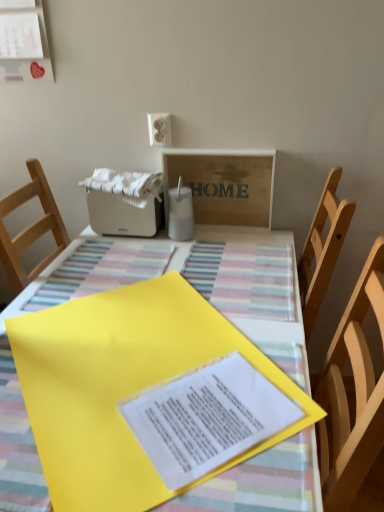
Question: Is yellow paper at center at the left side of yellow paper at center?

Choices:
 (A) no
 (B) yes

Answer: (A)

Question: From the image's perspective, is yellow paper at center on top of yellow paper at center?

Choices:
 (A) no
 (B) yes

Answer: (B)

Question: Is yellow paper at center looking in the opposite direction of yellow paper at center?

Choices:
 (A) yes
 (B) no

Answer: (B)

Question: From the image's perspective, is yellow paper at center beneath yellow paper at center?

Choices:
 (A) no
 (B) yes

Answer: (A)

Question: Is yellow paper at center behind yellow paper at center?

Choices:
 (A) yes
 (B) no

Answer: (A)

Question: Considering the positions of white plastic toaster at upper center and wooden signboard at upper center in the image, is white plastic toaster at upper center wider or thinner than wooden signboard at upper center?

Choices:
 (A) wide
 (B) thin

Answer: (A)

Question: From the image's perspective, is white plastic toaster at upper center above or below wooden signboard at upper center?

Choices:
 (A) below
 (B) above

Answer: (A)

Question: Is white plastic toaster at upper center to the left or to the right of wooden signboard at upper center in the image?

Choices:
 (A) right
 (B) left

Answer: (B)

Question: In terms of size, does white plastic toaster at upper center appear bigger or smaller than wooden signboard at upper center?

Choices:
 (A) small
 (B) big

Answer: (B)

Question: Visually, is yellow paper at center positioned to the left or to the right of wooden signboard at upper center?

Choices:
 (A) left
 (B) right

Answer: (A)

Question: From their relative heights in the image, would you say yellow paper at center is taller or shorter than wooden signboard at upper center?

Choices:
 (A) tall
 (B) short

Answer: (B)

Question: From the image's perspective, is yellow paper at center positioned above or below wooden signboard at upper center?

Choices:
 (A) below
 (B) above

Answer: (A)

Question: Which is correct: yellow paper at center is inside wooden signboard at upper center, or outside of it?

Choices:
 (A) inside
 (B) outside

Answer: (B)

Question: From their relative heights in the image, would you say wooden signboard at upper center is taller or shorter than yellow paper at center?

Choices:
 (A) short
 (B) tall

Answer: (B)

Question: Visually, is wooden signboard at upper center positioned to the left or to the right of yellow paper at center?

Choices:
 (A) right
 (B) left

Answer: (A)